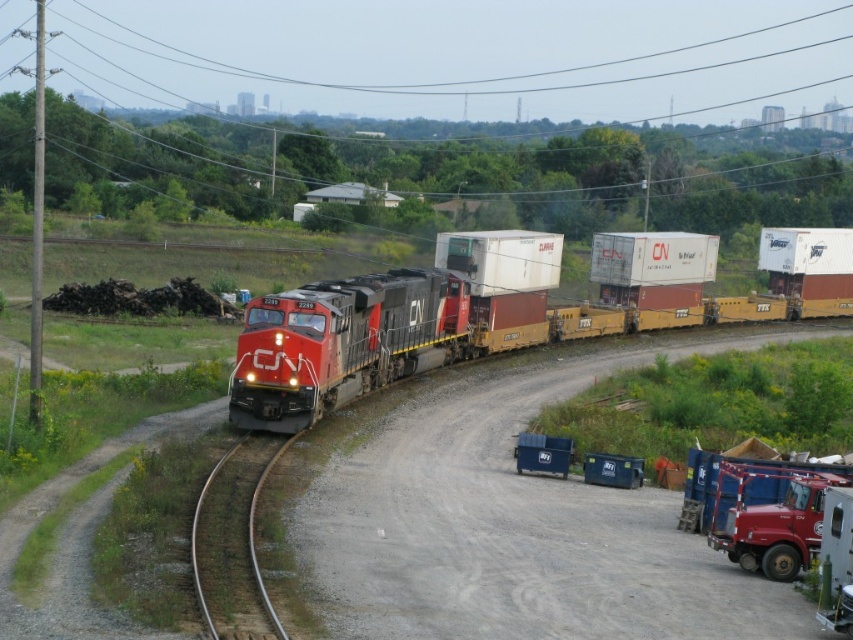
You are a pedestrian standing at the edge of the railway tracks. You see the red glossy trailer truck at lower right and the metal at left. Which object is positioned higher in the image?

The red glossy trailer truck at lower right is above the metal at left, so it is positioned higher in the image.

You are standing at the edge of the railway and see the red glossy trailer truck at lower right. If you want to cross the tracks safely, which direction should you look first considering the truck is 20.96 meters away?

The red glossy trailer truck at lower right is 20.96 meters from the viewer. Since the truck is parked in the foreground near the tracks, you should look towards the direction of the approaching train first before crossing to ensure safety.

You are standing at the red truck parked in the foreground of the railway scene. You want to walk to the point labeled as point (x=273, y=611). However, there is an obstacle at point (x=399, y=268). Which point is closer to you so you can decide your path?

Point (x=273, y=611) is closer to you than point (x=399, y=268). Therefore, you should head towards point (x=273, y=611) first to avoid the obstacle at point (x=399, y=268).